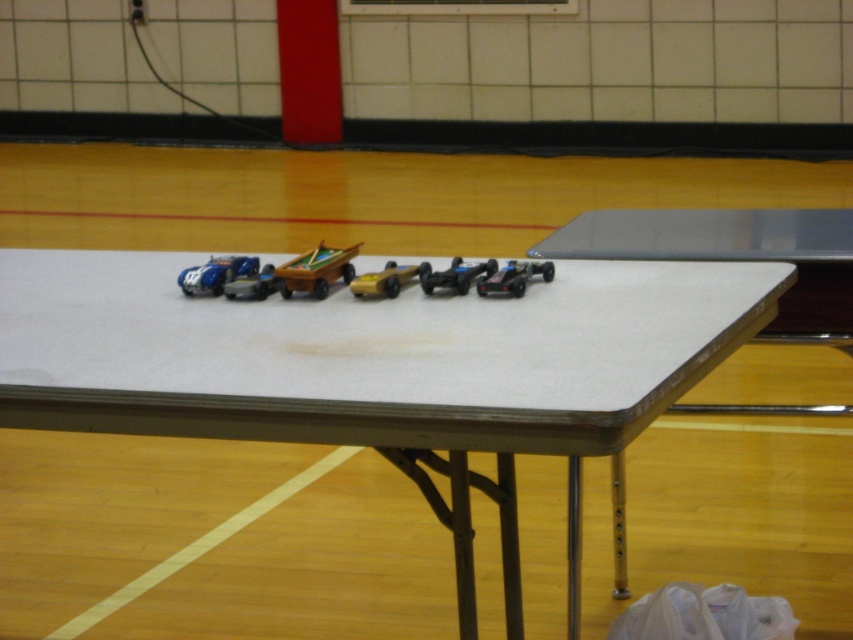
You are standing in a gymnasium and see the white matte table at center. If you want to place a 1.5 meter long object on the floor between you and the table, will there be enough space?

The distance between you and the white matte table at center is 1.54 meters. Since the object is 1.5 meters long, there is enough space to place it between you and the table.

You are standing in the gymnasium and see the white matte table at center and the shiny blue plastic toy car at left. From your perspective, which object is positioned to the right?

The white matte table at center is positioned to the right of the shiny blue plastic toy car at left, so the white matte table at center is on the right side.

You are a child who wants to reach the gold metallic car at center on the white matte table at center. Considering the table height, can you easily grab it?

The white matte table at center is much taller than the gold metallic car at center, so it might be difficult for a child to reach the gold metallic car at center due to the table being too high.